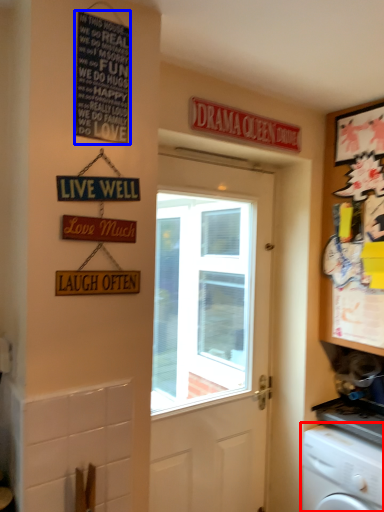
Question: Which point is further to the camera, washing machine (highlighted by a red box) or signage (highlighted by a blue box)?

Choices:
 (A) washing machine
 (B) signage

Answer: (A)